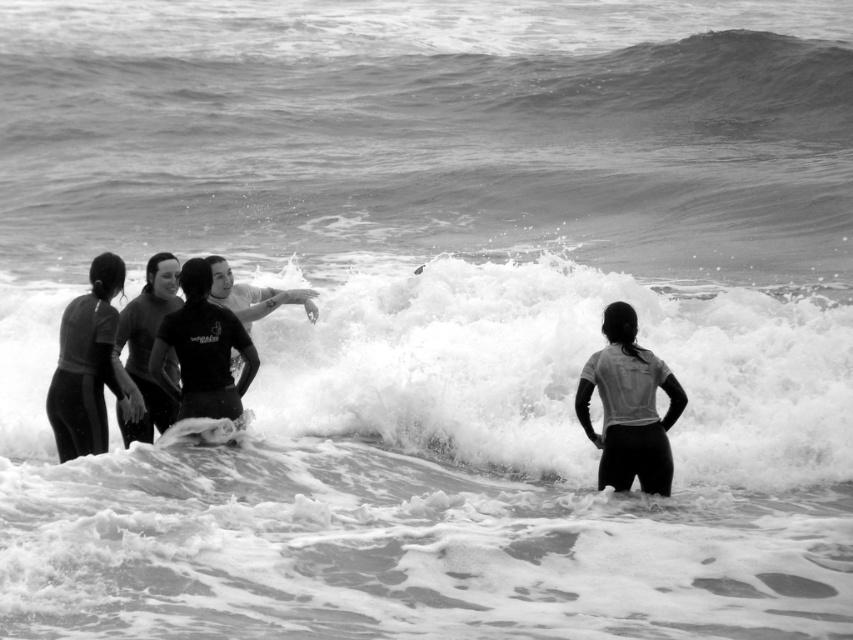
Question: Which object is closer to the camera taking this photo?

Choices:
 (A) white foam surfboard at center
 (B) light gray matte wetsuit at right
 (C) white frothy wave at center

Answer: (C)

Question: Does light gray matte wetsuit at right come behind black matte wetsuit at left?

Choices:
 (A) no
 (B) yes

Answer: (A)

Question: Does black matte wetsuit at center appear on the right side of dark gray matte wetsuit at center-left?

Choices:
 (A) no
 (B) yes

Answer: (B)

Question: Which is nearer to the black matte wetsuit at left?

Choices:
 (A) light gray matte wetsuit at right
 (B) black matte wetsuit at center
 (C) white foam surfboard at center

Answer: (B)

Question: Estimate the real-world distances between objects in this image. Which object is closer to the black matte wetsuit at left?

Choices:
 (A) black matte wetsuit at center
 (B) light gray matte wetsuit at right
 (C) white foam surfboard at center
 (D) white frothy wave at center

Answer: (A)

Question: In this image, where is black matte wetsuit at left located relative to black matte wetsuit at center?

Choices:
 (A) below
 (B) above

Answer: (A)